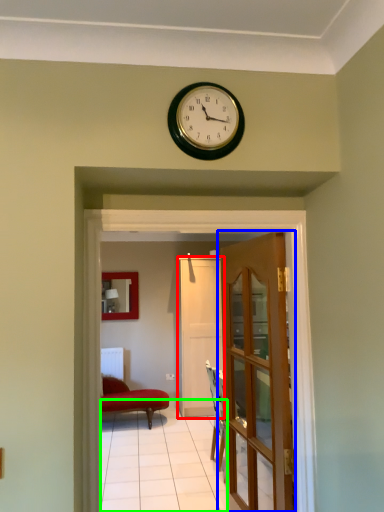
Question: Which object is the farthest from door (highlighted by a red box)? Choose among these: door (highlighted by a blue box) or path (highlighted by a green box).

Choices:
 (A) door
 (B) path

Answer: (A)